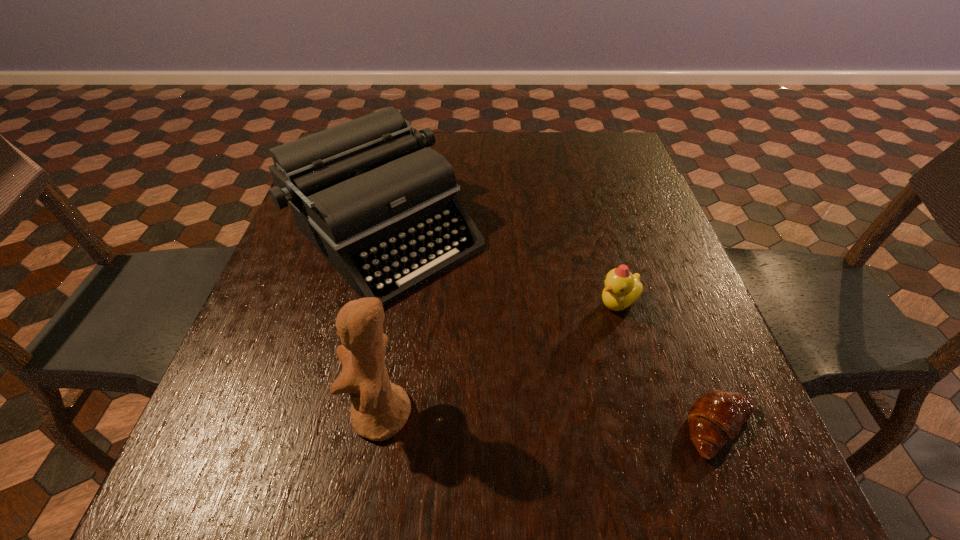
Image resolution: width=960 pixels, height=540 pixels. Identify the location of the tallest object. (380, 409).

Locate an element on the screen. crescent roll is located at coordinates (716, 417).

Where is `the rightmost object`? This screenshot has height=540, width=960. the rightmost object is located at coordinates (716, 417).

Locate an element on the screen. Image resolution: width=960 pixels, height=540 pixels. the second object from right to left is located at coordinates (622, 289).

Identify the location of the third tallest object. The width and height of the screenshot is (960, 540). (622, 289).

Where is `typewriter`? This screenshot has height=540, width=960. typewriter is located at coordinates (364, 192).

In order to click on free point located 0.170m on the front-facing side of the tallest object in this screenshot , I will do `click(249, 415)`.

Where is `free space located on the front-facing side of the tallest object`? This screenshot has height=540, width=960. free space located on the front-facing side of the tallest object is located at coordinates pyautogui.click(x=267, y=415).

Where is `free space located 0.100m on the front-facing side of the tallest object`? This screenshot has width=960, height=540. free space located 0.100m on the front-facing side of the tallest object is located at coordinates (291, 415).

Where is `free space located 0.190m on the left of the crescent roll`? free space located 0.190m on the left of the crescent roll is located at coordinates (565, 429).